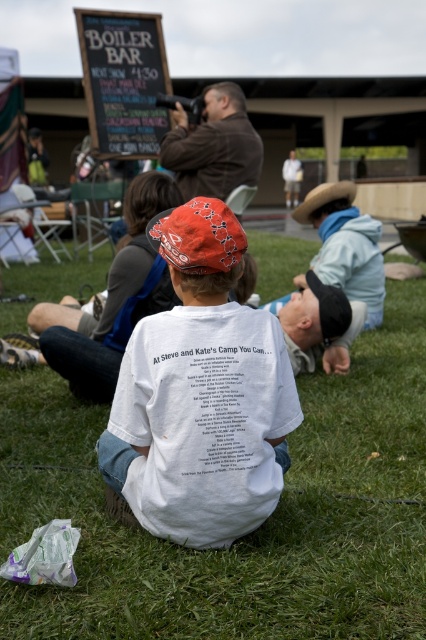
Does point (365, 480) come closer to viewer compared to point (238, 228)?

No, (365, 480) is behind (238, 228).

This screenshot has height=640, width=426. Identify the location of green grass at center. (253, 531).

Who is positioned more to the left, white cotton shirt at center or chalkboard sign at upper left?

From the viewer's perspective, chalkboard sign at upper left appears more on the left side.

The width and height of the screenshot is (426, 640). I want to click on white cotton shirt at center, so click(201, 394).

Where is `white cotton shirt at center`? The image size is (426, 640). white cotton shirt at center is located at coordinates (201, 394).

Is green grass at center positioned at the back of chalkboard sign at upper left?

No, green grass at center is in front of chalkboard sign at upper left.

Is point (307, 464) positioned in front of point (146, 104)?

Yes, it is in front of point (146, 104).

I want to click on green grass at center, so click(253, 531).